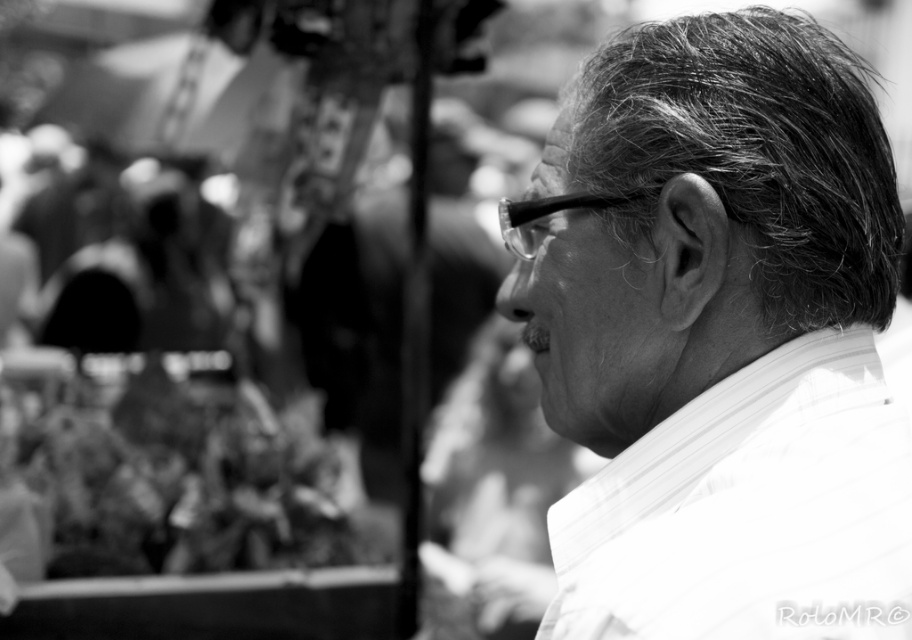
Question: Can you confirm if white textured shirt at right is positioned to the left of gray textured hair at upper right?

Choices:
 (A) no
 (B) yes

Answer: (B)

Question: Which of these objects is positioned closest to the gray textured hair at upper right?

Choices:
 (A) white textured shirt at right
 (B) white striped dress shirt at right

Answer: (A)

Question: Is white striped dress shirt at right thinner than gray textured hair at upper right?

Choices:
 (A) no
 (B) yes

Answer: (A)

Question: Does white textured shirt at right appear under white striped dress shirt at right?

Choices:
 (A) yes
 (B) no

Answer: (B)

Question: Among these points, which one is nearest to the camera?

Choices:
 (A) (763, 145)
 (B) (781, 481)

Answer: (B)

Question: Which of the following is the farthest from the observer?

Choices:
 (A) (641, 163)
 (B) (763, 26)
 (C) (909, 518)

Answer: (B)